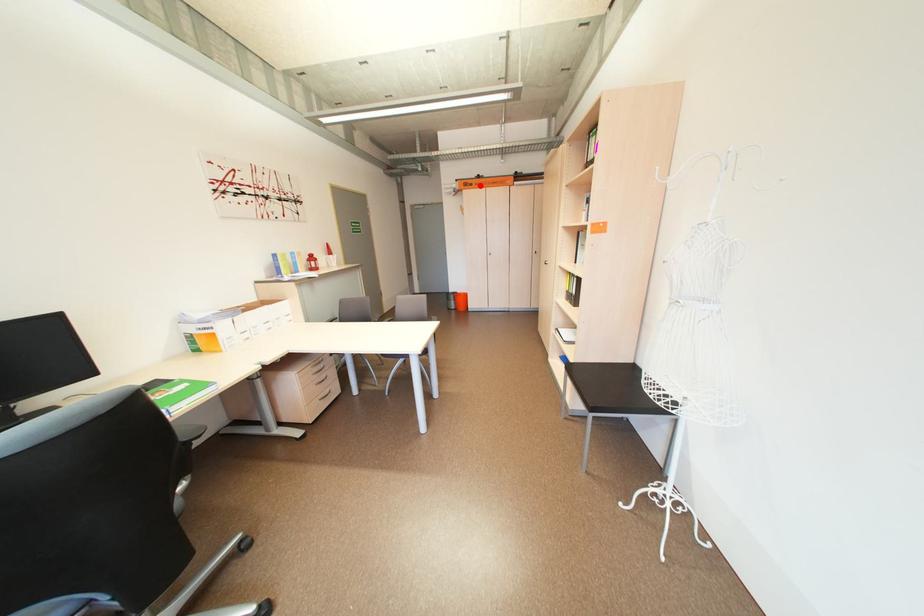
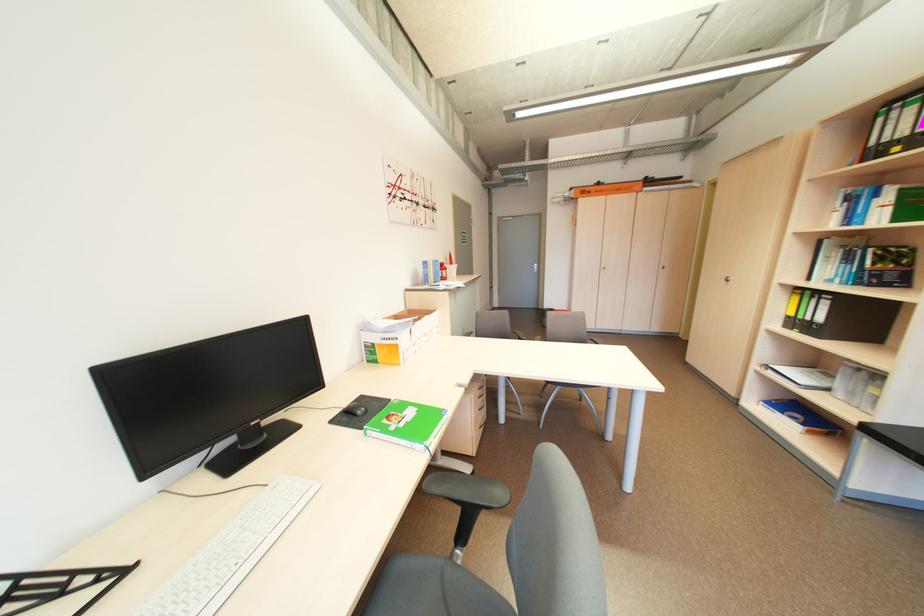
Question: I am providing you with two images of the same scene from different viewpoints. A red point is shown in image1. For the corresponding object point in image2, is it positioned nearer or farther from the camera?

Choices:
 (A) Nearer
 (B) Farther

Answer: (B)